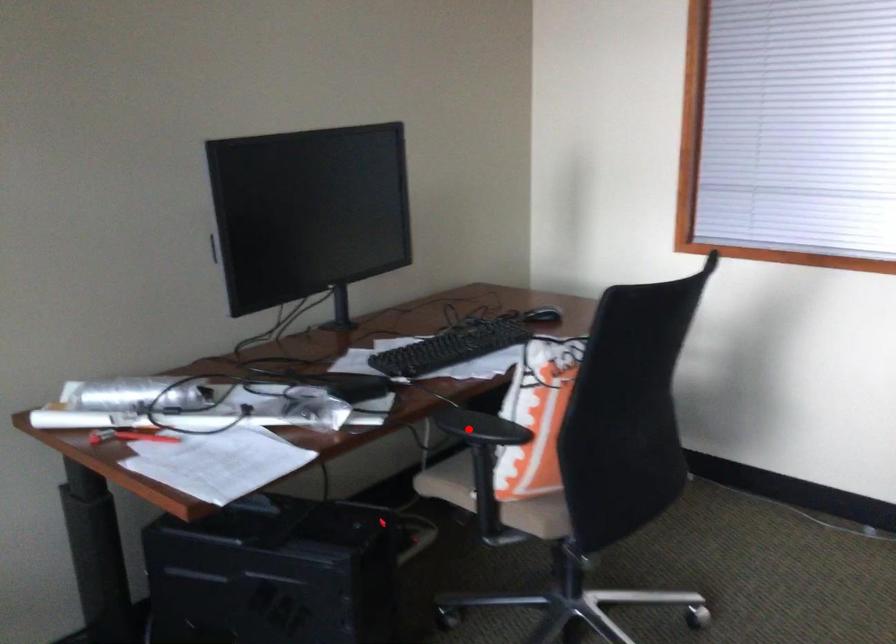
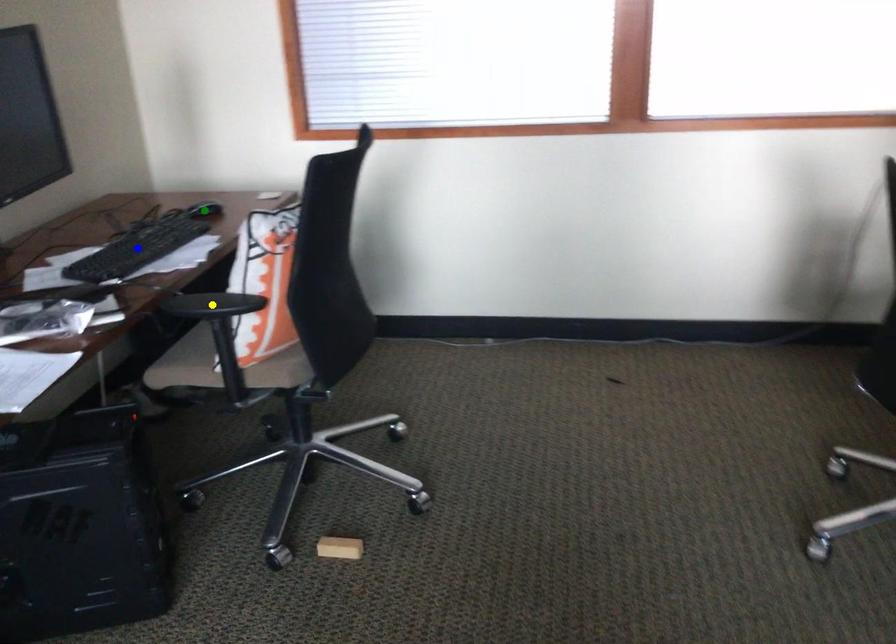
Question: I am providing you with two images of the same scene from different viewpoints. A red point is marked on the first image. You are given multiple points on the second image. Which spot in image 2 lines up with the point in image 1?

Choices:
 (A) blue point
 (B) green point
 (C) yellow point

Answer: (C)